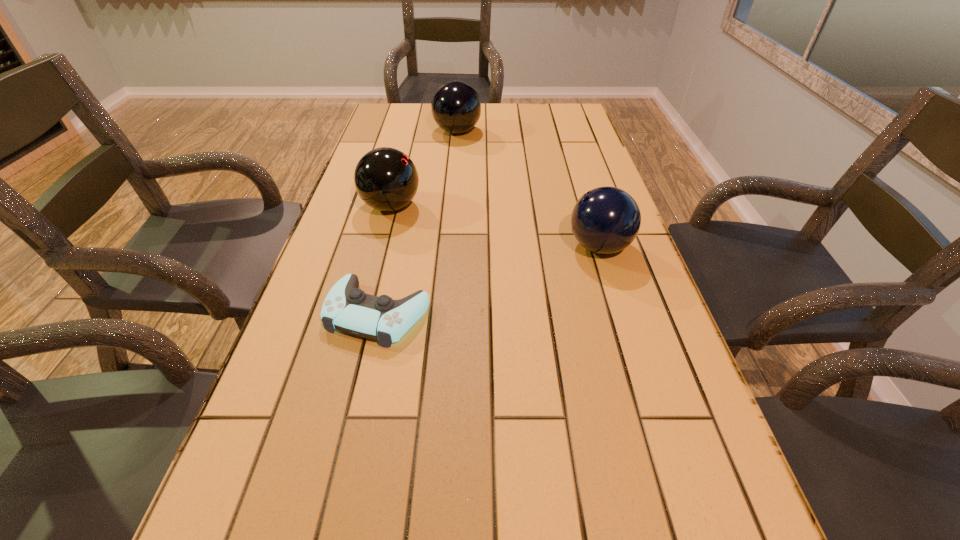
You are a GUI agent. You are given a task and a screenshot of the screen. Output one action in this format:
    pyautogui.click(x=<x>, y=<y>)
    Task: Click on the closest object to the second nearest bowling ball
    The image size is (960, 540).
    Given the screenshot: What is the action you would take?
    pyautogui.click(x=346, y=308)

The image size is (960, 540). Identify the location of object identified as the third closest to the shortest object. (456, 108).

Image resolution: width=960 pixels, height=540 pixels. I want to click on the closest bowling ball to the farthest bowling ball, so click(386, 179).

Locate which bowling ball is the second closest to the farthest object. Please provide its 2D coordinates. Your answer should be formatted as a tuple, i.e. [(x, y)], where the tuple contains the x and y coordinates of a point satisfying the conditions above.

[(605, 220)]

Locate an element on the screen. The height and width of the screenshot is (540, 960). free location that satisfies the following two spatial constraints: 1. on the surface of the third nearest object near the finger holes; 2. on the left side of the shortest object is located at coordinates (363, 314).

What are the coordinates of `free space that satisfies the following two spatial constraints: 1. on the side of the farthest object with the finger holes; 2. on the front side of the shortest object` in the screenshot? It's located at (442, 314).

What are the coordinates of `vacant position in the image that satisfies the following two spatial constraints: 1. on the surface of the second farthest bowling ball near the finger holes; 2. on the left side of the shortest object` in the screenshot? It's located at (363, 314).